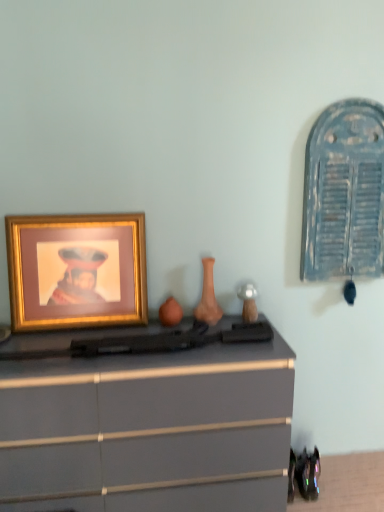
Locate an element on the screen. matte gray chest of drawers at center is located at coordinates 146,423.

Measure the distance between matte orange vase at center and camera.

A distance of 5.84 feet exists between matte orange vase at center and camera.

Measure the distance between gold metallic picture frame at left and camera.

gold metallic picture frame at left and camera are 1.68 meters apart from each other.

This screenshot has width=384, height=512. I want to click on matte gray chest of drawers at center, so click(x=146, y=423).

How many degrees apart are the facing directions of matte orange vase at center and gold metallic picture frame at left?

4.44 degrees.

Could you tell me if matte orange vase at center is facing gold metallic picture frame at left?

No, matte orange vase at center is not facing towards gold metallic picture frame at left.

Looking at their sizes, would you say matte orange vase at center is wider or thinner than gold metallic picture frame at left?

In the image, matte orange vase at center appears to be wider than gold metallic picture frame at left.

Can you see matte orange vase at center touching gold metallic picture frame at left?

No, matte orange vase at center is not touching gold metallic picture frame at left.

Looking at this image, is gold metallic picture frame at left positioned with its back to matte orange vase at center?

No, gold metallic picture frame at left is not facing the opposite direction of matte orange vase at center.

From the picture: From the image's perspective, is gold metallic picture frame at left above or below matte orange vase at center?

Based on their image positions, gold metallic picture frame at left is located above matte orange vase at center.

What's the angular difference between gold metallic picture frame at left and matte orange vase at center's facing directions?

The angle between the facing direction of gold metallic picture frame at left and the facing direction of matte orange vase at center is 4.44 degrees.

Is point (96, 281) positioned after point (204, 309)?

No, it is not.

Can you confirm if gold metallic picture frame at left is shorter than matte gray chest of drawers at center?

Indeed, gold metallic picture frame at left has a lesser height compared to matte gray chest of drawers at center.

Is gold metallic picture frame at left aimed at matte gray chest of drawers at center?

No, gold metallic picture frame at left is not aimed at matte gray chest of drawers at center.

Does gold metallic picture frame at left have a greater width compared to matte gray chest of drawers at center?

No.

From a real-world perspective, does gold metallic picture frame at left sit lower than matte gray chest of drawers at center?

No, from a real-world perspective, gold metallic picture frame at left is not beneath matte gray chest of drawers at center.

Who is shorter, matte gray chest of drawers at center or gold metallic picture frame at left?

Standing shorter between the two is gold metallic picture frame at left.

How many degrees apart are the facing directions of matte gray chest of drawers at center and gold metallic picture frame at left?

0.104 degrees separate the facing orientations of matte gray chest of drawers at center and gold metallic picture frame at left.

Identify the location of picture frame above the matte gray chest of drawers at center (from the image's perspective). (76, 270).

Consider the image. Is matte gray chest of drawers at center wider than gold metallic picture frame at left?

Correct, the width of matte gray chest of drawers at center exceeds that of gold metallic picture frame at left.

From a real-world perspective, is matte orange vase at center below matte gray chest of drawers at center?

No.

What's the angular difference between matte orange vase at center and matte gray chest of drawers at center's facing directions?

matte orange vase at center and matte gray chest of drawers at center are facing 4.55 degrees away from each other.

Considering the sizes of matte orange vase at center and matte gray chest of drawers at center in the image, is matte orange vase at center bigger or smaller than matte gray chest of drawers at center?

Clearly, matte orange vase at center is smaller in size than matte gray chest of drawers at center.

Is matte gray chest of drawers at center oriented towards matte orange vase at center?

No, matte gray chest of drawers at center is not aimed at matte orange vase at center.

Can matte orange vase at center be found inside matte gray chest of drawers at center?

No, matte orange vase at center is not surrounded by matte gray chest of drawers at center.

Is matte gray chest of drawers at center next to matte orange vase at center and touching it?

No, matte gray chest of drawers at center is not making contact with matte orange vase at center.

In order to click on picture frame above the matte orange vase at center (from a real-world perspective) in this screenshot , I will do `click(76, 270)`.

Where is `vase below the gold metallic picture frame at left (from a real-world perspective)`? This screenshot has width=384, height=512. vase below the gold metallic picture frame at left (from a real-world perspective) is located at coordinates (208, 296).

Looking at the image, which one is located closer to matte orange vase at center, gold metallic picture frame at left or matte gray chest of drawers at center?

gold metallic picture frame at left is positioned closer to the anchor matte orange vase at center.

Which object lies nearer to the anchor point matte orange vase at center, matte gray chest of drawers at center or gold metallic picture frame at left?

gold metallic picture frame at left.

From the image, which object appears to be farther from matte gray chest of drawers at center, gold metallic picture frame at left or matte orange vase at center?

matte orange vase at center is further to matte gray chest of drawers at center.

When comparing their distances from matte gray chest of drawers at center, does matte orange vase at center or gold metallic picture frame at left seem closer?

gold metallic picture frame at left is closer to matte gray chest of drawers at center.

Based on the photo, based on their spatial positions, is matte gray chest of drawers at center or matte orange vase at center further from gold metallic picture frame at left?

matte orange vase at center.

Considering their positions, is matte orange vase at center positioned closer to gold metallic picture frame at left than matte gray chest of drawers at center?

Among the two, matte gray chest of drawers at center is located nearer to gold metallic picture frame at left.

You are a GUI agent. You are given a task and a screenshot of the screen. Output one action in this format:
    pyautogui.click(x=<x>, y=<y>)
    Task: Click on the vase between gold metallic picture frame at left and matte gray chest of drawers at center vertically
    
    Given the screenshot: What is the action you would take?
    click(208, 296)